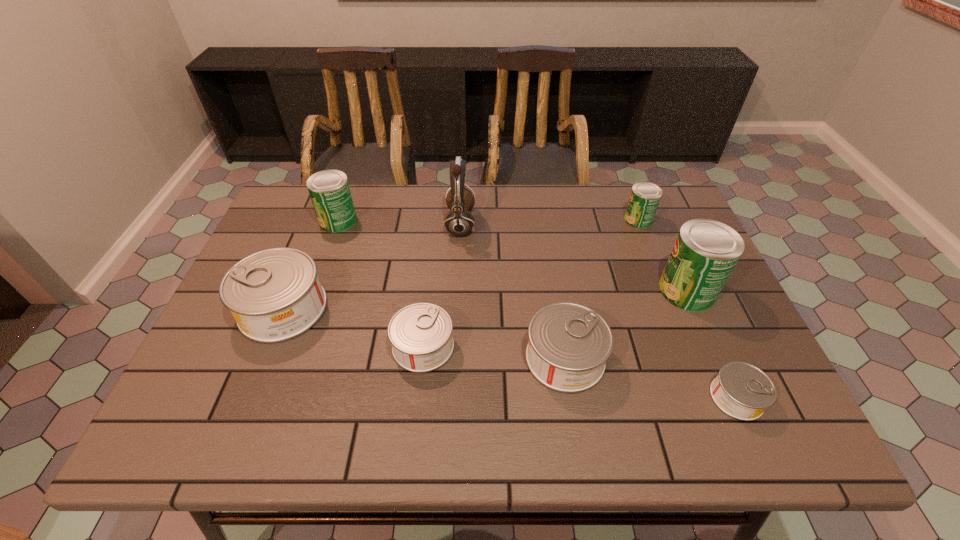
Locate an element on the screen. brown earphone is located at coordinates (459, 221).

Find the location of `the tallest object`. the tallest object is located at coordinates (459, 221).

Where is `the seventh shortest object`? the seventh shortest object is located at coordinates (706, 251).

This screenshot has height=540, width=960. I want to click on the biggest green can, so click(706, 251).

Image resolution: width=960 pixels, height=540 pixels. Identify the location of the second tallest can. (329, 190).

Image resolution: width=960 pixels, height=540 pixels. I want to click on the second smallest green can, so click(329, 190).

Where is `the biggest silver can`? The height and width of the screenshot is (540, 960). the biggest silver can is located at coordinates (275, 295).

Where is `the smallest green can`? This screenshot has width=960, height=540. the smallest green can is located at coordinates (644, 199).

The width and height of the screenshot is (960, 540). Identify the location of the fourth can from right to left. (569, 343).

The image size is (960, 540). Identify the location of the third silver can from left to right. (569, 343).